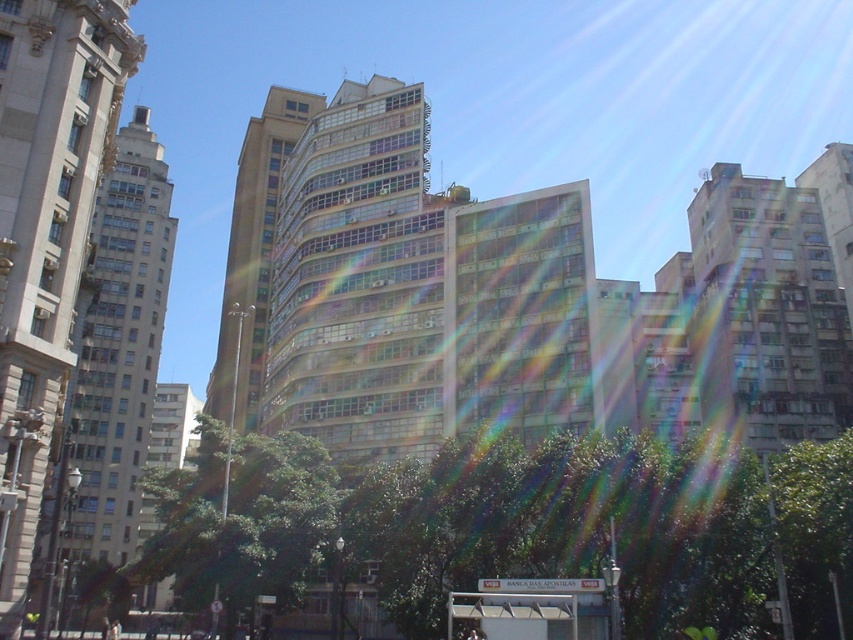
Question: Which object is farther from the camera taking this photo?

Choices:
 (A) smooth beige building at left
 (B) green leafy tree at lower center
 (C) green leafy tree at center

Answer: (C)

Question: In this image, where is green leafy tree at lower center located relative to smooth beige building at left?

Choices:
 (A) above
 (B) below

Answer: (B)

Question: Which of the following is the farthest from the observer?

Choices:
 (A) (223, 545)
 (B) (141, 481)
 (C) (605, 612)

Answer: (B)

Question: Is green leafy tree at lower center to the right of smooth beige building at left from the viewer's perspective?

Choices:
 (A) no
 (B) yes

Answer: (B)

Question: Can you confirm if smooth beige building at left is positioned to the right of white plastic bus stop at lower center?

Choices:
 (A) no
 (B) yes

Answer: (A)

Question: Estimate the real-world distances between objects in this image. Which object is closer to the green leafy tree at lower center?

Choices:
 (A) smooth beige building at left
 (B) green leafy tree at center
 (C) white plastic bus stop at lower center

Answer: (B)